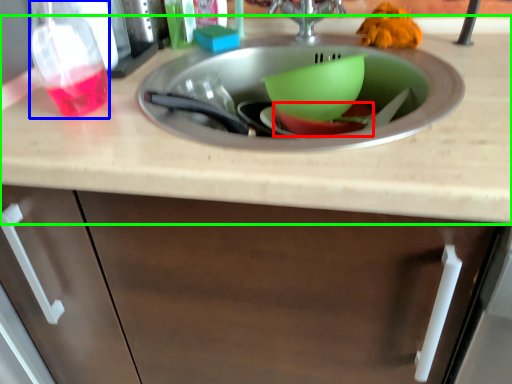
Question: Which object is positioned farthest from basin (highlighted by a red box)? Select from bottle (highlighted by a blue box) and countertop (highlighted by a green box).

Choices:
 (A) bottle
 (B) countertop

Answer: (A)